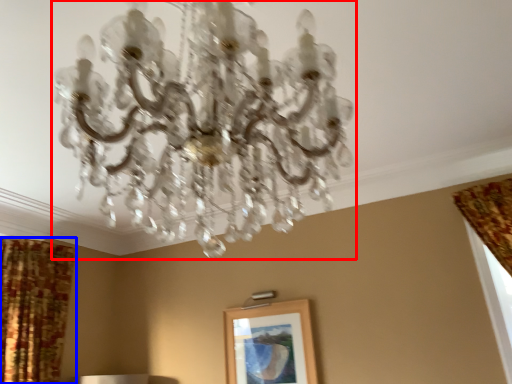
Question: Which object appears closest to the camera in this image, lamp (highlighted by a red box) or curtain (highlighted by a blue box)?

Choices:
 (A) lamp
 (B) curtain

Answer: (A)